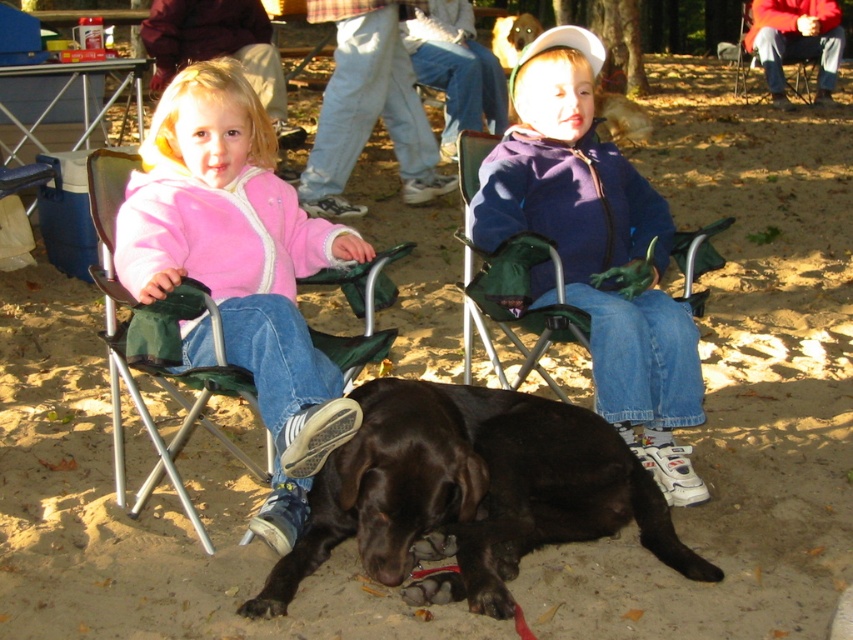
Question: Is shiny black dog at center behind purple fleece jacket at center?

Choices:
 (A) yes
 (B) no

Answer: (B)

Question: Is shiny black dog at center further to the viewer compared to pink fleece jacket at left?

Choices:
 (A) no
 (B) yes

Answer: (B)

Question: Is shiny black dog at center further to camera compared to pink fleece jacket at left?

Choices:
 (A) yes
 (B) no

Answer: (A)

Question: Estimate the real-world distances between objects in this image. Which object is farther from the purple fleece jacket at center?

Choices:
 (A) shiny black dog at center
 (B) pink fleece jacket at left

Answer: (B)

Question: Based on their relative distances, which object is nearer to the purple fleece jacket at center?

Choices:
 (A) pink fleece jacket at left
 (B) shiny black dog at center

Answer: (B)

Question: Which of the following is the closest to the observer?

Choices:
 (A) (202, 102)
 (B) (491, 536)

Answer: (B)